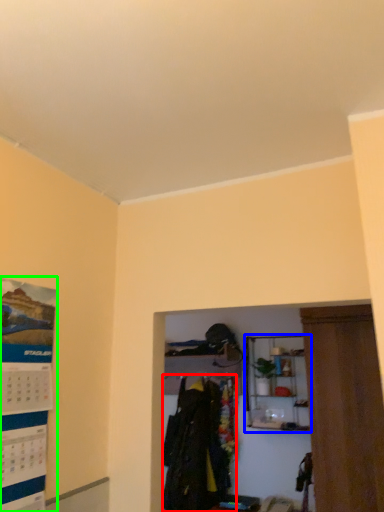
Question: Based on their relative distances, which object is farther from clothing (highlighted by a red box)? Choose from shelf (highlighted by a blue box) and poster page (highlighted by a green box).

Choices:
 (A) shelf
 (B) poster page

Answer: (B)